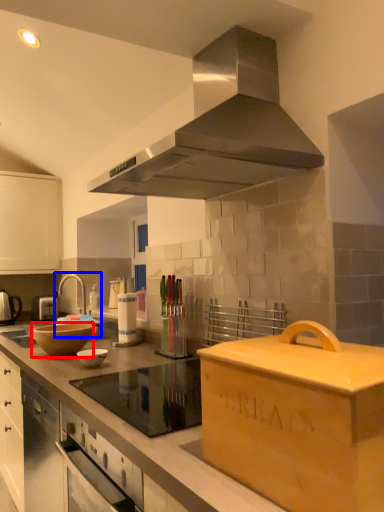
Question: Which point is further to the camera, mixing bowl (highlighted by a red box) or sink (highlighted by a blue box)?

Choices:
 (A) mixing bowl
 (B) sink

Answer: (B)